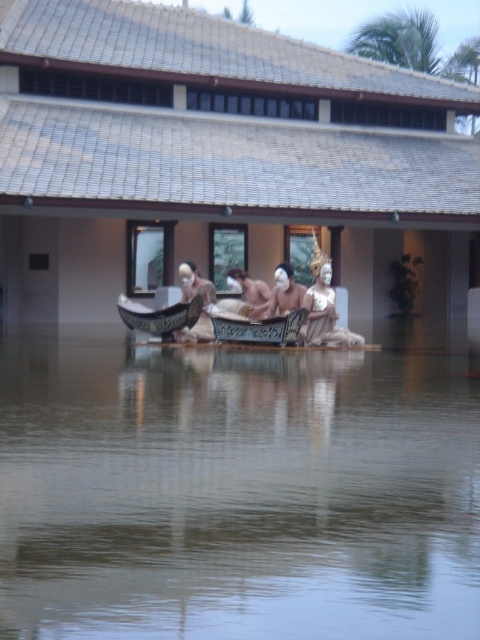
Can you confirm if clear water at center is wider than smooth wooden boat at center?

Yes.

Is point (202, 364) positioned behind point (260, 307)?

No, it is not.

This screenshot has width=480, height=640. What do you see at coordinates (237, 493) in the screenshot? I see `clear water at center` at bounding box center [237, 493].

The width and height of the screenshot is (480, 640). I want to click on clear water at center, so click(x=237, y=493).

The image size is (480, 640). I want to click on dark brown polished wood boat at center, so click(x=259, y=328).

Does dark brown polished wood boat at center appear under shiny dark wood boat at center?

Correct, dark brown polished wood boat at center is located below shiny dark wood boat at center.

Does point (218, 336) lie in front of point (164, 330)?

That is True.

You are a GUI agent. You are given a task and a screenshot of the screen. Output one action in this format:
    pyautogui.click(x=<x>, y=<y>)
    Task: Click on the dark brown polished wood boat at center
    The width and height of the screenshot is (480, 640).
    Given the screenshot: What is the action you would take?
    pyautogui.click(x=259, y=328)

Does clear water at center appear on the right side of shiny dark wood boat at center?

Indeed, clear water at center is positioned on the right side of shiny dark wood boat at center.

At what (x,y) coordinates should I click in order to perform the action: click on clear water at center. Please return your answer as a coordinate pair (x, y). Image resolution: width=480 pixels, height=640 pixels. Looking at the image, I should click on (237, 493).

This screenshot has width=480, height=640. What are the coordinates of `clear water at center` in the screenshot? It's located at (x=237, y=493).